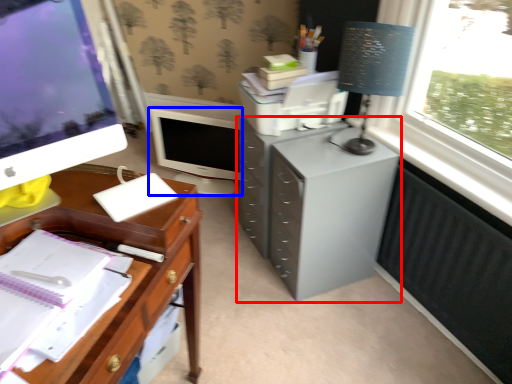
Question: Which object is further to the camera taking this photo, filing cabinet (highlighted by a red box) or computer monitor (highlighted by a blue box)?

Choices:
 (A) filing cabinet
 (B) computer monitor

Answer: (B)